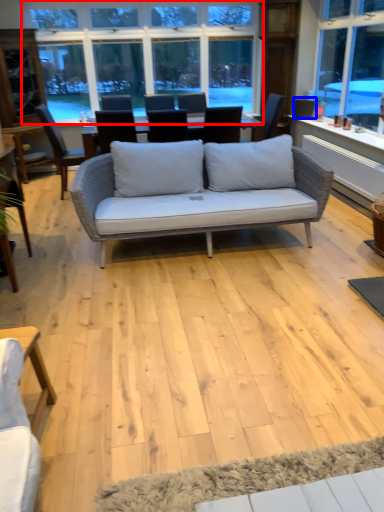
Question: Which object appears closest to the camera in this image, window (highlighted by a red box) or armchair (highlighted by a blue box)?

Choices:
 (A) window
 (B) armchair

Answer: (A)